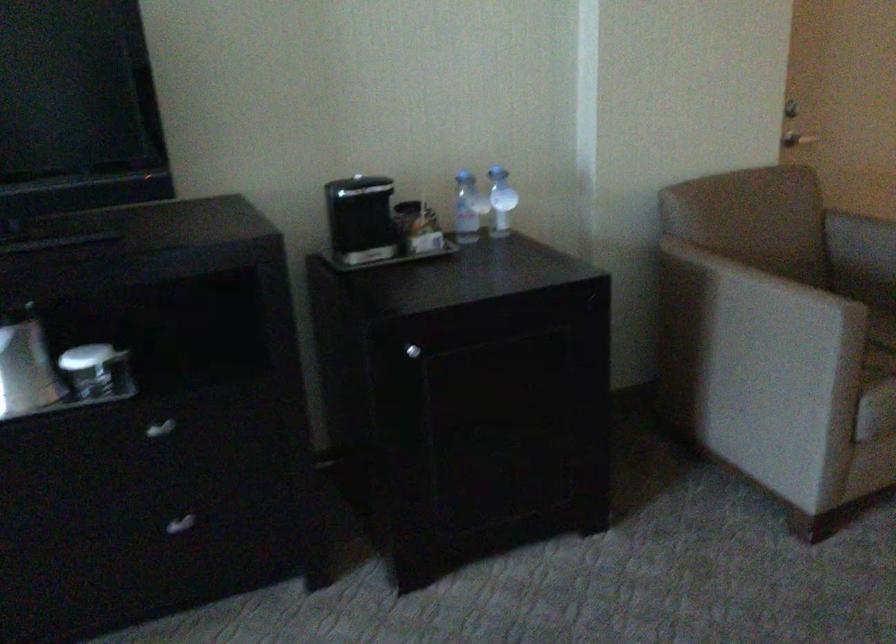
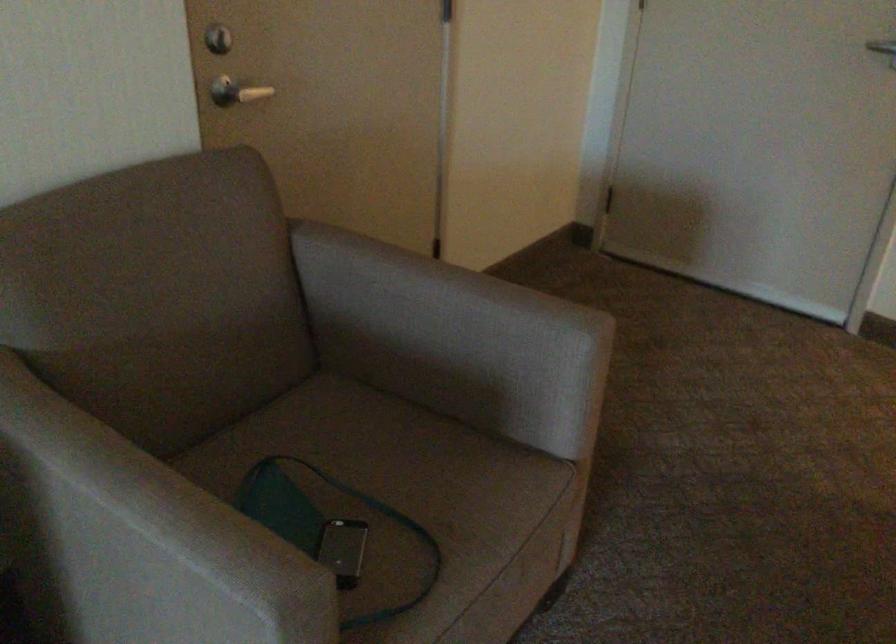
The point at (770, 290) is marked in the first image. Where is the corresponding point in the second image?

(150, 538)